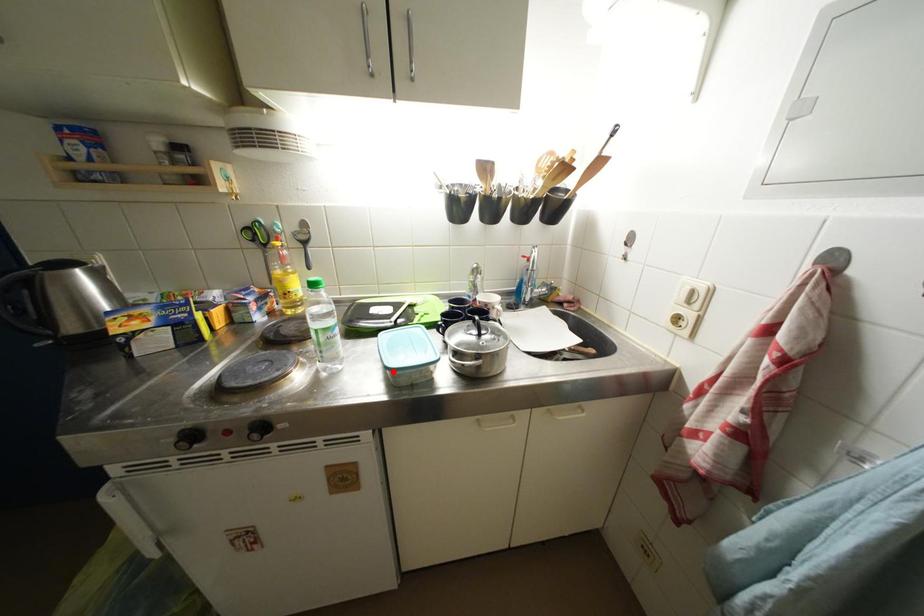
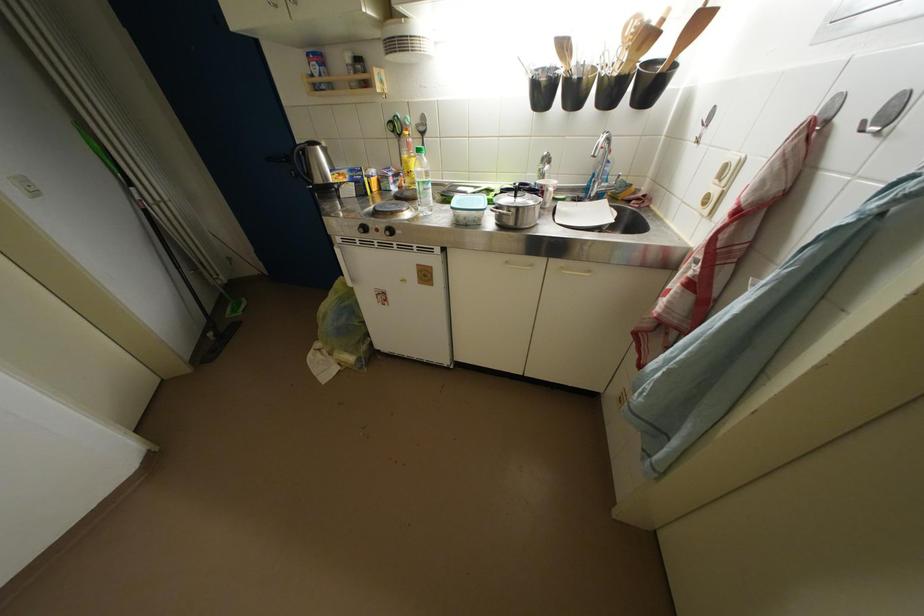
Locate, in the second image, the point that corresponds to the highlighted location in the first image.

(458, 212)